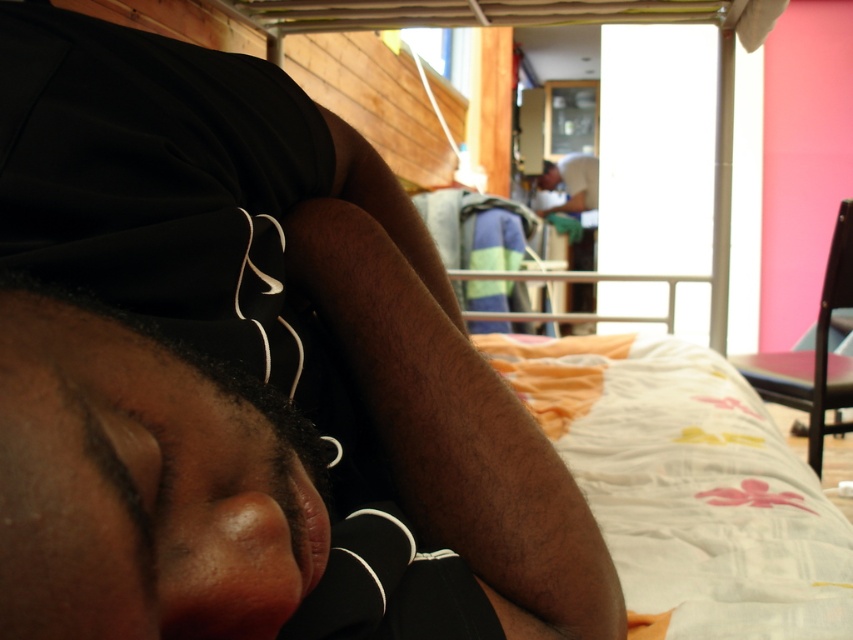
You are a tailor trying to decide which fabric to use for a new project. You have the black fabric at center and the white cotton shirt at center in front of you. Based on their widths, which one would you choose if you need a wider material?

The white cotton shirt at center has a greater width than the black fabric at center, so you should choose the white cotton shirt at center for a wider material.

You are standing in the room and want to place a small plant between the two points, point (335,538) and point (576,157). Which point should the plant be closer to in order to be nearer to you?

The plant should be placed closer to point (335,538) because it is closer to the viewer than point (576,157).

You are a delivery robot with a package that is 5 inches long. You need to place it between the black fabric at center and the black matte head at center. Is there enough space to fit the package between them?

The distance between the black fabric at center and the black matte head at center is 4.25 inches. Since the package is 5 inches long, it will not fit in the space between them.